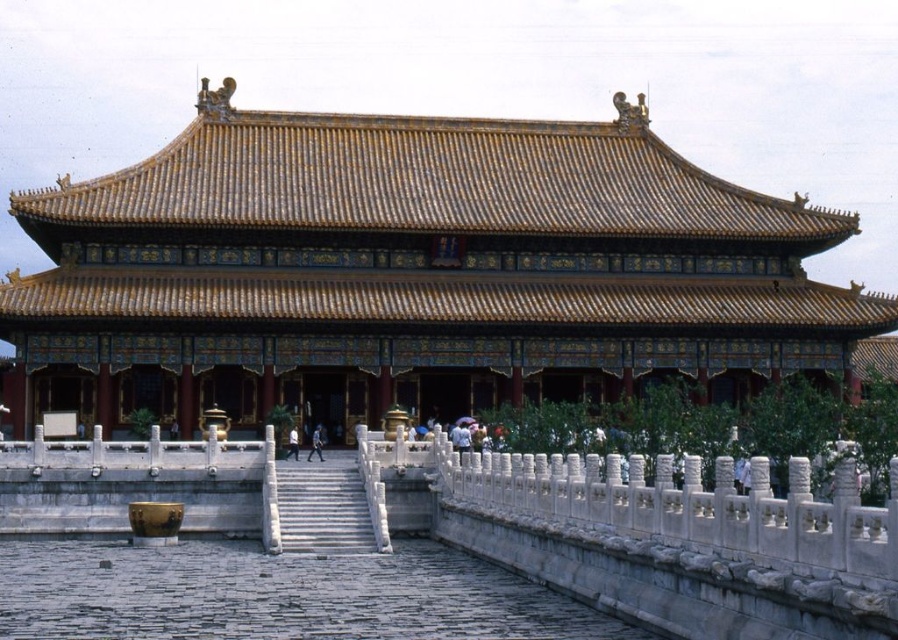
Between golden glazed tile palace at center and blue fabric person at center, which one appears on the left side from the viewer's perspective?

blue fabric person at center is more to the left.

Which is in front, point (208, 211) or point (319, 429)?

Point (319, 429)

I want to click on golden glazed tile palace at center, so click(x=414, y=269).

Is golden glazed tile palace at center positioned at the back of white marble stairs at center?

Yes, golden glazed tile palace at center is behind white marble stairs at center.

Is point (690, 218) closer to camera compared to point (289, 528)?

No.

At what (x,y) coordinates should I click in order to perform the action: click on golden glazed tile palace at center. Please return your answer as a coordinate pair (x, y). This screenshot has height=640, width=898. Looking at the image, I should click on (414, 269).

Can you confirm if blue fabric person at center is thinner than light blue fabric person at center?

Indeed, blue fabric person at center has a lesser width compared to light blue fabric person at center.

Identify the location of blue fabric person at center. The width and height of the screenshot is (898, 640). (315, 444).

Between point (317, 440) and point (291, 451), which one is positioned in front?

Point (291, 451) is more forward.

I want to click on blue fabric person at center, so click(x=315, y=444).